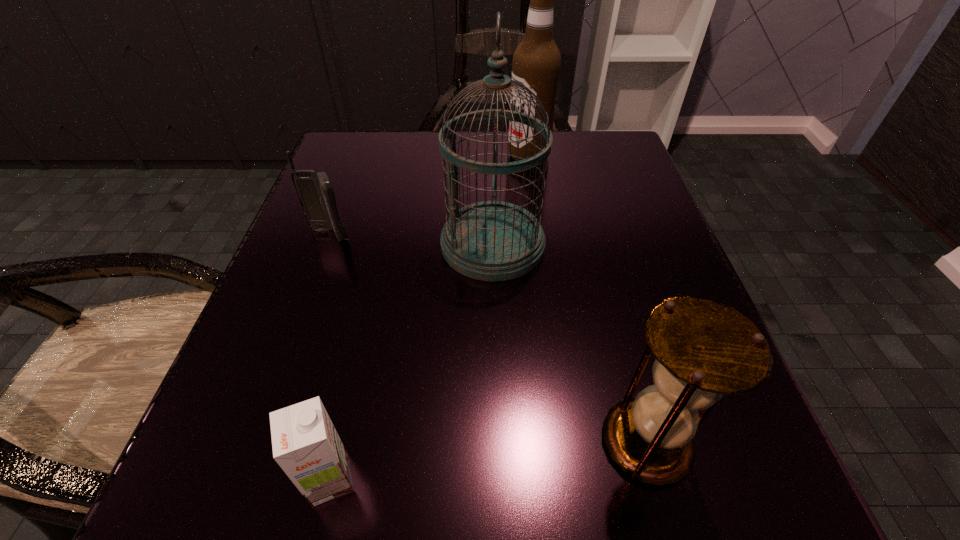
Locate an element on the screen. This screenshot has width=960, height=540. vacant region located 0.210m on the front-facing side of the birdcage is located at coordinates (318, 245).

Image resolution: width=960 pixels, height=540 pixels. What are the coordinates of `free spot located on the back of the third shortest object` in the screenshot? It's located at (596, 254).

This screenshot has width=960, height=540. I want to click on free point located 0.360m on the keyboard of the cellular telephone, so click(x=250, y=456).

Locate an element on the screen. vacant area located 0.110m on the back of the fourth object from right to left is located at coordinates (355, 370).

At what (x,y) coordinates should I click in order to perform the action: click on object present at the far edge. Please return your answer as a coordinate pair (x, y). This screenshot has width=960, height=540. Looking at the image, I should click on (536, 63).

Find the location of a particular element. The image size is (960, 540). hourglass located at the near edge is located at coordinates (703, 348).

Locate an element on the screen. The image size is (960, 540). chocolate milk that is at the near edge is located at coordinates (305, 443).

The image size is (960, 540). Find the location of `cellular telephone present at the left edge`. cellular telephone present at the left edge is located at coordinates (315, 191).

Find the location of `chocolate milk at the left edge`. chocolate milk at the left edge is located at coordinates (305, 443).

I want to click on object positioned at the right edge, so click(x=703, y=348).